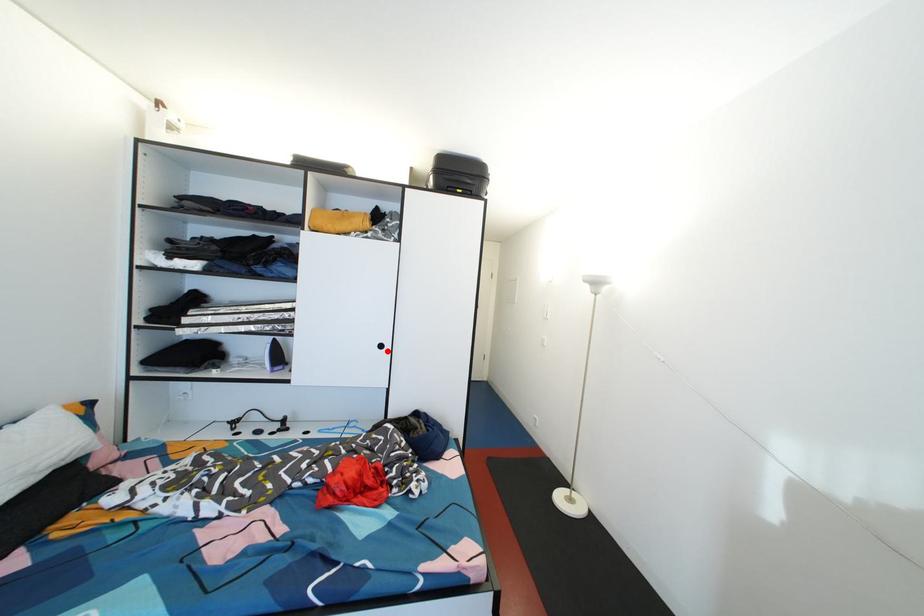
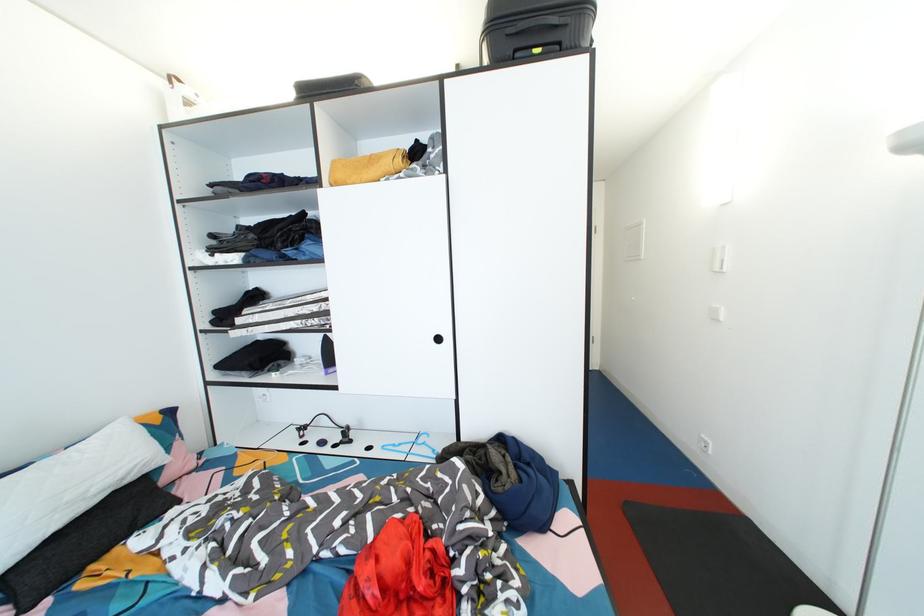
Question: I am providing you with two images of the same scene from different viewpoints. In image1, a red point is highlighted. Considering the same 3D point in image2, which of the following is correct?

Choices:
 (A) It is closer
 (B) It is farther

Answer: (A)